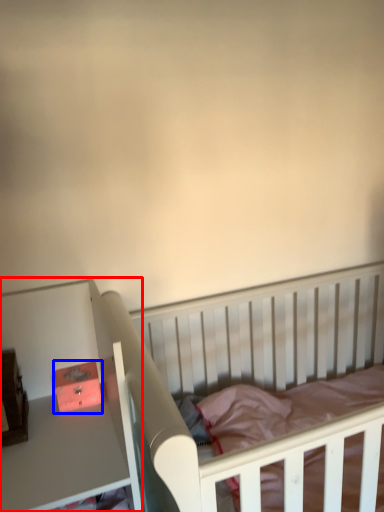
Question: Which of the following is the farthest to the observer, table (highlighted by a red box) or box (highlighted by a blue box)?

Choices:
 (A) table
 (B) box

Answer: (B)